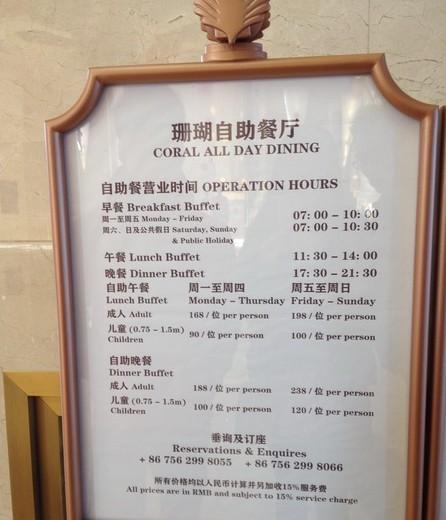
Where is `left side of menu frame`? left side of menu frame is located at coordinates (64, 324).